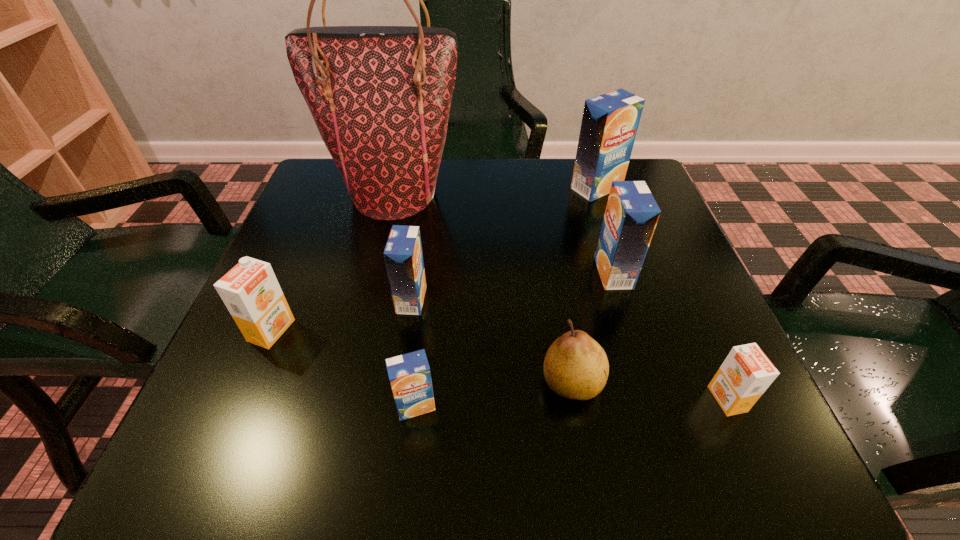
At what (x,y) coordinates should I click in order to perform the action: click on the smallest blue orange_juice. Please return your answer as a coordinate pair (x, y). Looking at the image, I should click on (409, 374).

At what (x,y) coordinates should I click in order to perform the action: click on the smaller orange orange juice. Please return your answer as a coordinate pair (x, y). This screenshot has height=540, width=960. Looking at the image, I should click on (746, 373).

At what (x,y) coordinates should I click in order to perform the action: click on the rightmost object. Please return your answer as a coordinate pair (x, y). The image size is (960, 540). Looking at the image, I should click on (746, 373).

The width and height of the screenshot is (960, 540). In order to click on free spot located 0.280m on the right of the tallest object in this screenshot , I will do `click(581, 194)`.

Locate an element on the screen. free space located 0.350m on the left of the farthest blue orange_juice is located at coordinates (425, 188).

I want to click on vacant space located 0.160m on the left of the second biggest blue orange_juice, so click(516, 273).

Locate an element on the screen. The image size is (960, 540). blank area located on the front of the second smallest blue orange_juice is located at coordinates (402, 363).

At what (x,y) coordinates should I click in order to perform the action: click on vacant space positioned 0.300m on the back of the left orange orange juice. Please return your answer as a coordinate pair (x, y). The width and height of the screenshot is (960, 540). Looking at the image, I should click on (322, 211).

Locate an element on the screen. The height and width of the screenshot is (540, 960). vacant space positioned on the back of the pear is located at coordinates (549, 248).

Locate an element on the screen. The image size is (960, 540). free location located on the back of the nearest blue orange_juice is located at coordinates (421, 353).